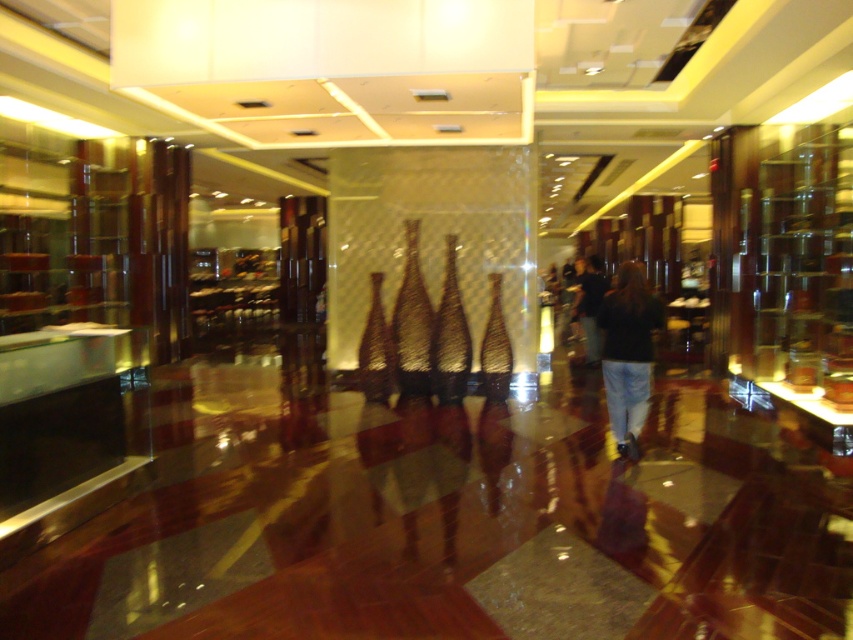
Question: Does black denim jeans at center have a lesser width compared to dark blue jeans at center?

Choices:
 (A) yes
 (B) no

Answer: (B)

Question: Among these points, which one is farthest from the camera?

Choices:
 (A) (599, 275)
 (B) (624, 355)

Answer: (A)

Question: Which point is closer to the camera?

Choices:
 (A) black denim jeans at center
 (B) dark blue jeans at center

Answer: (A)

Question: Can you confirm if black denim jeans at center is thinner than dark blue jeans at center?

Choices:
 (A) no
 (B) yes

Answer: (A)

Question: Which point appears closest to the camera in this image?

Choices:
 (A) (590, 342)
 (B) (619, 385)

Answer: (B)

Question: In this image, where is black denim jeans at center located relative to dark blue jeans at center?

Choices:
 (A) above
 (B) below

Answer: (B)